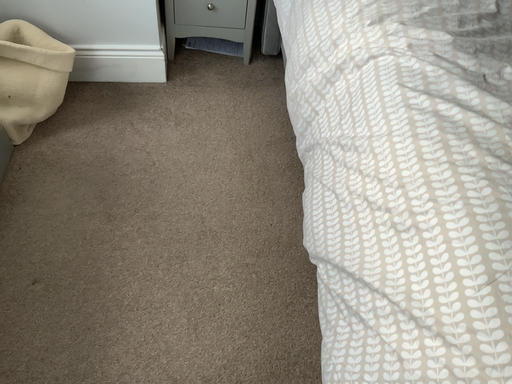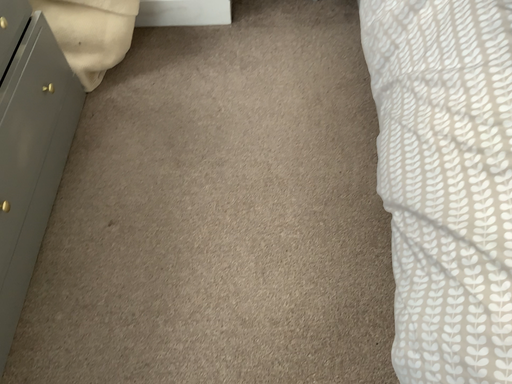
Question: How did the camera likely rotate when shooting the video?

Choices:
 (A) rotated left
 (B) rotated right

Answer: (A)